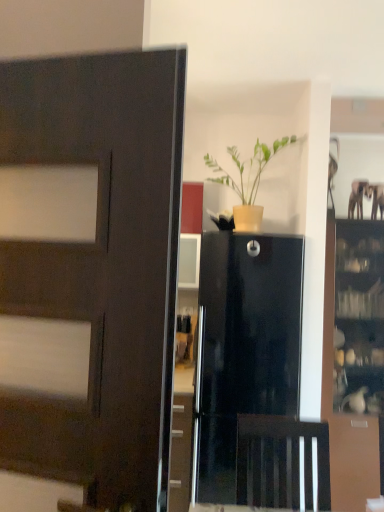
What is the approximate width of yellow matte pot at upper center?

yellow matte pot at upper center is 12.09 inches in width.

This screenshot has height=512, width=384. I want to click on yellow matte pot at upper center, so click(x=248, y=180).

The height and width of the screenshot is (512, 384). Describe the element at coordinates (248, 180) in the screenshot. I see `yellow matte pot at upper center` at that location.

Measure the distance between point (x=275, y=148) and camera.

Point (x=275, y=148) is 2.76 meters away from camera.

In order to click on yellow matte pot at upper center in this screenshot , I will do `click(248, 180)`.